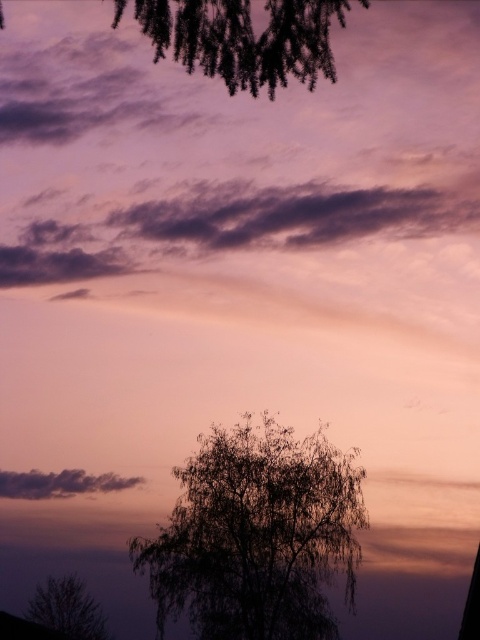
Question: Which of the following is the closest to the observer?

Choices:
 (A) (74, 609)
 (B) (182, 26)
 (C) (249, 241)
 (D) (233, 461)

Answer: (B)

Question: Can you confirm if dark purple cloud at upper center is positioned to the right of dark gray cloud at upper left?

Choices:
 (A) no
 (B) yes

Answer: (B)

Question: Estimate the real-world distances between objects in this image. Which object is closer to the dark green textured leaves at upper center?

Choices:
 (A) dark gray cloud at upper left
 (B) silvery metallic tree at lower left
 (C) silvery branches at center
 (D) dark purple cloud at upper center

Answer: (D)

Question: Is silvery branches at center to the right of dark purple cloud at upper center from the viewer's perspective?

Choices:
 (A) no
 (B) yes

Answer: (B)

Question: Which point is closer to the camera taking this photo?

Choices:
 (A) (364, 211)
 (B) (60, 621)
 (C) (45, 484)
 (D) (274, 67)

Answer: (D)

Question: Does silvery branches at center appear over silvery metallic tree at lower left?

Choices:
 (A) no
 (B) yes

Answer: (B)